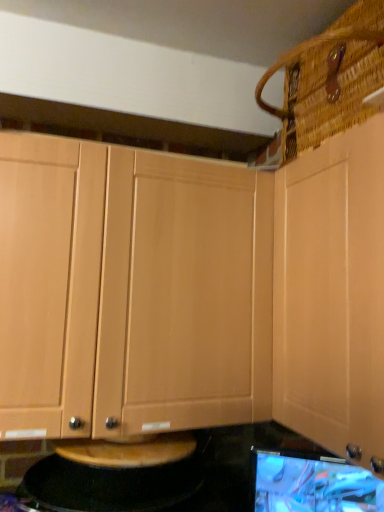
Question: Is matte black monitor at lower right positioned far away from black granite countertop at lower center?

Choices:
 (A) no
 (B) yes

Answer: (A)

Question: From the image's perspective, would you say matte black monitor at lower right is shown under black granite countertop at lower center?

Choices:
 (A) no
 (B) yes

Answer: (B)

Question: From the image's perspective, is matte black monitor at lower right over black granite countertop at lower center?

Choices:
 (A) no
 (B) yes

Answer: (A)

Question: Would you say black granite countertop at lower center is part of matte black monitor at lower right's contents?

Choices:
 (A) no
 (B) yes

Answer: (A)

Question: Considering the relative positions of matte black monitor at lower right and black granite countertop at lower center in the image provided, is matte black monitor at lower right to the left of black granite countertop at lower center from the viewer's perspective?

Choices:
 (A) no
 (B) yes

Answer: (A)

Question: From a real-world perspective, does matte black monitor at lower right stand above black granite countertop at lower center?

Choices:
 (A) no
 (B) yes

Answer: (A)

Question: From a real-world perspective, is light wood cabinet at center, which ranks as the 1th cabinetry in left-to-right order, positioned over light wood cabinet at upper right, which is the first cabinetry in right-to-left order, based on gravity?

Choices:
 (A) yes
 (B) no

Answer: (B)

Question: Is light wood cabinet at center, the second cabinetry in the right-to-left sequence, shorter than light wood cabinet at upper right, which is the first cabinetry in right-to-left order?

Choices:
 (A) no
 (B) yes

Answer: (B)

Question: Would you say light wood cabinet at center, the second cabinetry in the right-to-left sequence, is outside light wood cabinet at upper right, the second cabinetry viewed from the left?

Choices:
 (A) no
 (B) yes

Answer: (B)

Question: Could you tell me if light wood cabinet at center, the second cabinetry in the right-to-left sequence, is facing light wood cabinet at upper right, which is the first cabinetry in right-to-left order?

Choices:
 (A) yes
 (B) no

Answer: (B)

Question: Is light wood cabinet at center, which ranks as the 1th cabinetry in left-to-right order, taller than light wood cabinet at upper right, the second cabinetry viewed from the left?

Choices:
 (A) no
 (B) yes

Answer: (A)

Question: Considering the relative positions of light wood cabinet at center, which ranks as the 1th cabinetry in left-to-right order, and light wood cabinet at upper right, which is the first cabinetry in right-to-left order, in the image provided, is light wood cabinet at center, which ranks as the 1th cabinetry in left-to-right order, to the right of light wood cabinet at upper right, which is the first cabinetry in right-to-left order, from the viewer's perspective?

Choices:
 (A) no
 (B) yes

Answer: (A)

Question: Is light wood cabinet at upper right, which is the first cabinetry in right-to-left order, surrounding light wood cabinet at center, the second cabinetry in the right-to-left sequence?

Choices:
 (A) no
 (B) yes

Answer: (A)